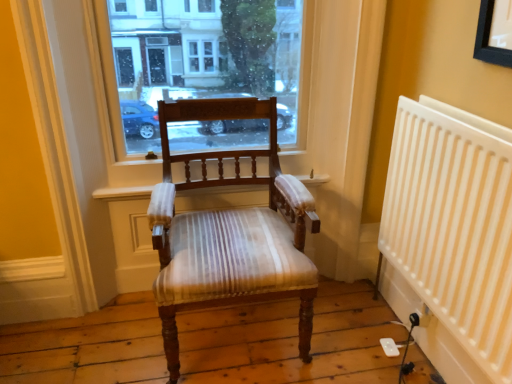
Question: Which direction should I rotate to look at wooden chair with striped upholstery at center?

Choices:
 (A) left
 (B) right

Answer: (A)

Question: Can you confirm if transparent glass window at center is shorter than wooden chair with striped upholstery at center?

Choices:
 (A) yes
 (B) no

Answer: (A)

Question: Does transparent glass window at center have a lesser width compared to wooden chair with striped upholstery at center?

Choices:
 (A) no
 (B) yes

Answer: (B)

Question: Considering the relative sizes of transparent glass window at center and wooden chair with striped upholstery at center in the image provided, is transparent glass window at center wider than wooden chair with striped upholstery at center?

Choices:
 (A) yes
 (B) no

Answer: (B)

Question: Does transparent glass window at center have a smaller size compared to wooden chair with striped upholstery at center?

Choices:
 (A) no
 (B) yes

Answer: (B)

Question: Is transparent glass window at center far away from wooden chair with striped upholstery at center?

Choices:
 (A) no
 (B) yes

Answer: (A)

Question: Is transparent glass window at center bigger than wooden chair with striped upholstery at center?

Choices:
 (A) no
 (B) yes

Answer: (A)

Question: Is white plastic radiator at right closer to the viewer compared to transparent glass window at center?

Choices:
 (A) no
 (B) yes

Answer: (B)

Question: From the image's perspective, is white plastic radiator at right located beneath transparent glass window at center?

Choices:
 (A) no
 (B) yes

Answer: (B)

Question: Is white plastic radiator at right wider than transparent glass window at center?

Choices:
 (A) yes
 (B) no

Answer: (B)

Question: Does white plastic radiator at right have a larger size compared to transparent glass window at center?

Choices:
 (A) yes
 (B) no

Answer: (A)

Question: From the image's perspective, is white plastic radiator at right over transparent glass window at center?

Choices:
 (A) yes
 (B) no

Answer: (B)

Question: From a real-world perspective, does white plastic radiator at right sit lower than transparent glass window at center?

Choices:
 (A) no
 (B) yes

Answer: (B)

Question: Is transparent glass window at center beside white plastic radiator at right?

Choices:
 (A) yes
 (B) no

Answer: (B)